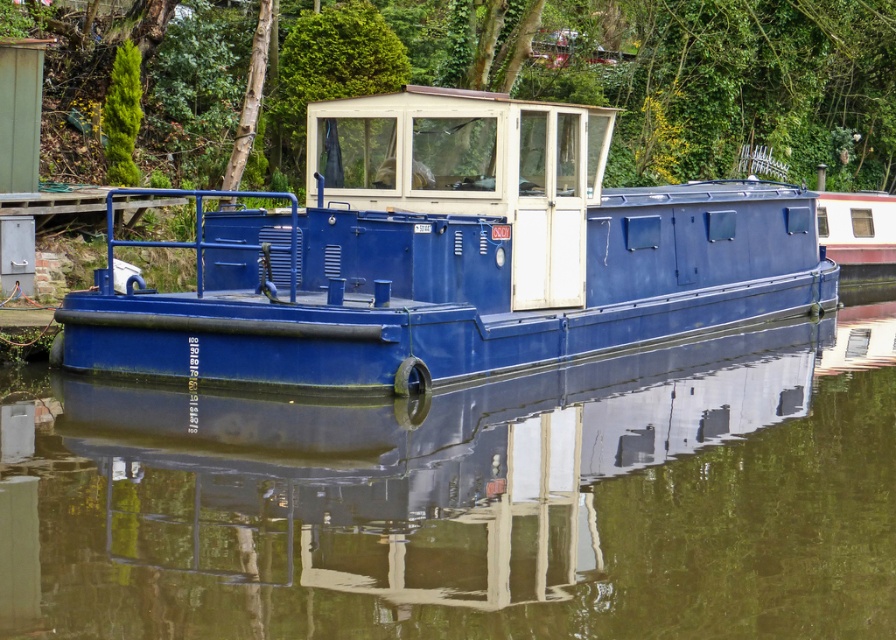
Question: Which point is farther to the camera?

Choices:
 (A) (638, 464)
 (B) (386, 314)
 (C) (235, 48)

Answer: (C)

Question: Which of the following is the farthest from the observer?

Choices:
 (A) (662, 257)
 (B) (130, 634)

Answer: (A)

Question: Does glossy blue boat at center have a greater width compared to matte blue boat at center?

Choices:
 (A) no
 (B) yes

Answer: (A)

Question: Which object appears closest to the camera in this image?

Choices:
 (A) matte blue boat at center
 (B) green leafy tree at upper center
 (C) glossy blue boat at center

Answer: (C)

Question: Can you confirm if glossy blue boat at center is positioned above green leafy tree at upper center?

Choices:
 (A) no
 (B) yes

Answer: (A)

Question: Can you confirm if glossy blue boat at center is bigger than matte blue boat at center?

Choices:
 (A) yes
 (B) no

Answer: (B)